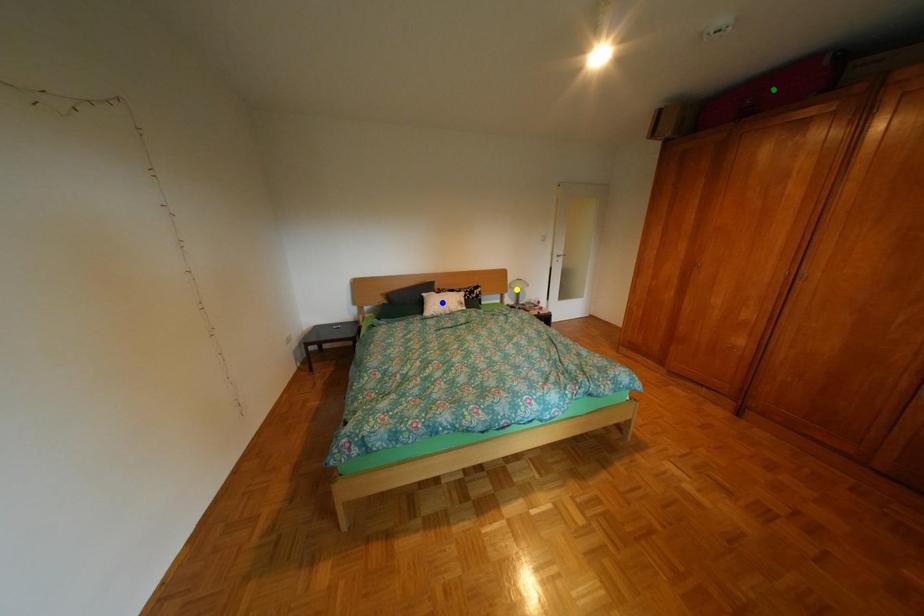
Order these from nearest to farthest:
green point | yellow point | blue point

green point < blue point < yellow point